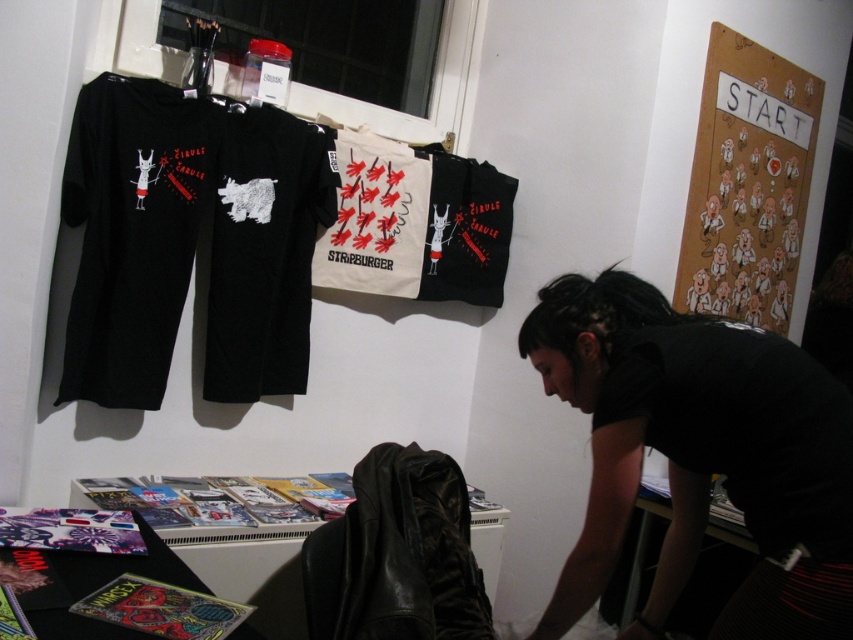
Question: Observing the image, what is the correct spatial positioning of black matte shirt at lower right in reference to black matte t-shirt at center?

Choices:
 (A) left
 (B) right

Answer: (B)

Question: Is black matte shirt at lower right smaller than black matte t-shirt at center?

Choices:
 (A) yes
 (B) no

Answer: (B)

Question: Which point is closer to the camera?

Choices:
 (A) black matte t-shirt at center
 (B) black matte shirt at lower right

Answer: (B)

Question: Is black matte shirt at lower right below black matte t-shirt at center?

Choices:
 (A) no
 (B) yes

Answer: (B)

Question: Which point is closer to the camera taking this photo?

Choices:
 (A) (641, 342)
 (B) (239, 198)

Answer: (A)